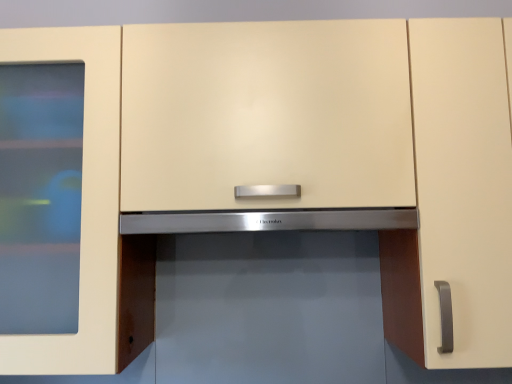
This screenshot has width=512, height=384. What do you see at coordinates (267, 220) in the screenshot? I see `satin silver exhaust hood at center` at bounding box center [267, 220].

Locate an element on the screen. The image size is (512, 384). satin silver exhaust hood at center is located at coordinates (267, 220).

At what (x,y) coordinates should I click in order to perform the action: click on satin silver exhaust hood at center. Please return your answer as a coordinate pair (x, y). This screenshot has height=384, width=512. Looking at the image, I should click on [267, 220].